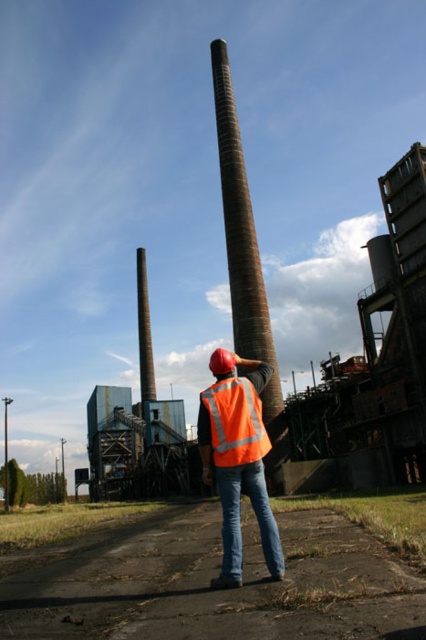
Does point (238, 256) come closer to viewer compared to point (149, 504)?

Yes.

Is rusty metal chimney at center wider than brown dirt road at lower center?

No, rusty metal chimney at center is not wider than brown dirt road at lower center.

Measure the distance between point (232,236) and camera.

A distance of 230.61 feet exists between point (232,236) and camera.

Locate an element on the screen. The height and width of the screenshot is (640, 426). rusty metal chimney at center is located at coordinates (241, 240).

Between point (233, 595) and point (230, 474), which one is positioned in front?

Positioned in front is point (233, 595).

The width and height of the screenshot is (426, 640). What are the coordinates of `jeans at center` in the screenshot? It's located at (219, 592).

What do you see at coordinates (241, 240) in the screenshot? This screenshot has width=426, height=640. I see `rusty metal chimney at center` at bounding box center [241, 240].

Is rusty metal chimney at center thinner than orange reflective safety vest at center?

No.

Describe the element at coordinates (241, 240) in the screenshot. I see `rusty metal chimney at center` at that location.

Where is `rusty metal chimney at center`? This screenshot has height=640, width=426. rusty metal chimney at center is located at coordinates (241, 240).